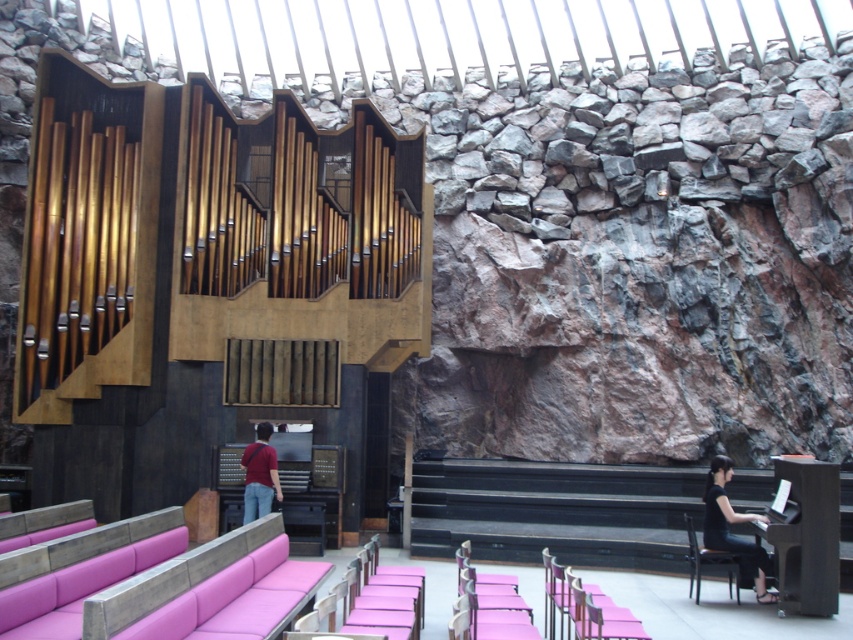
You are a photographer setting up for a concert. You see the black fabric at lower right and the matte red shirt at center. Which object is positioned to the right of the other?

The black fabric at lower right is to the right of the matte red shirt at center.

You are standing in the concert hall and want to know how far you are from the point marked at coordinates point (758, 573). Can you determine the distance?

The point (758, 573) is 21.06 feet away from the camera, so you are approximately 21.06 feet away from the point marked at coordinates point (758, 573).